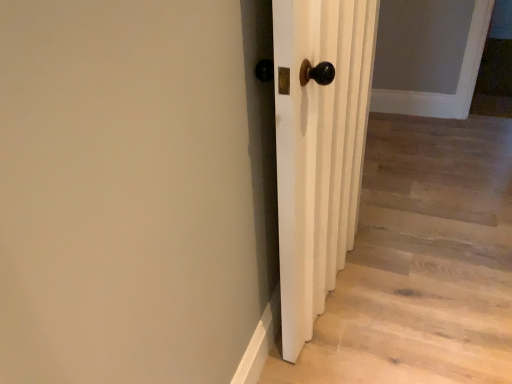
You are a GUI agent. You are given a task and a screenshot of the screen. Output one action in this format:
    pyautogui.click(x=<x>, y=<y>)
    Task: Click on the vacant space to the right of white wooden door at center
    This screenshot has height=384, width=512.
    Given the screenshot: What is the action you would take?
    pyautogui.click(x=418, y=292)